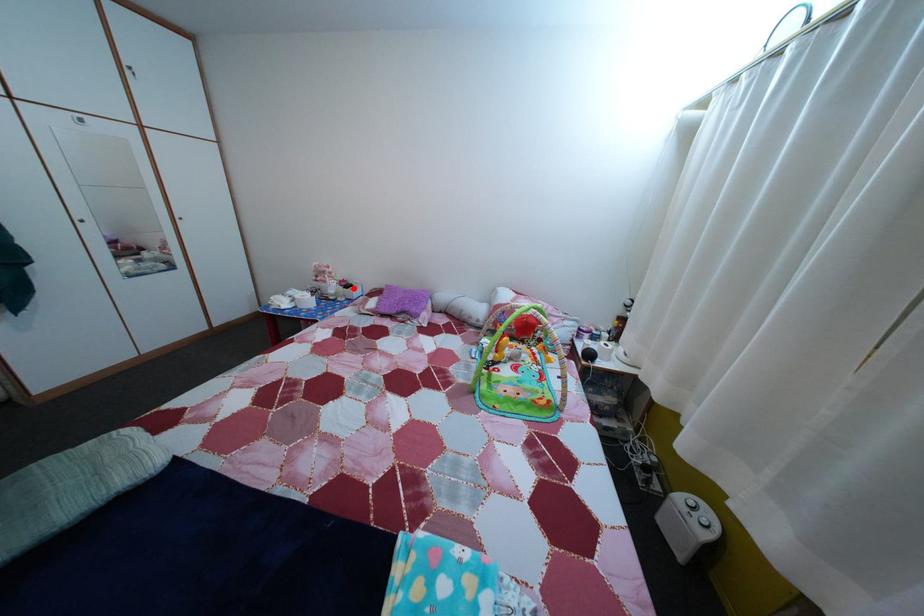
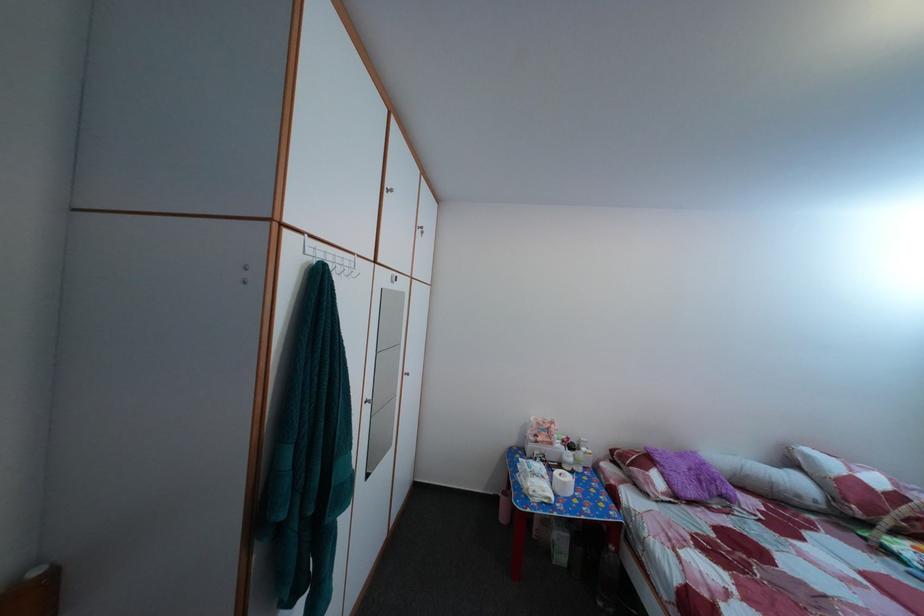
Question: A red point is marked in image1. In image2, is the corresponding 3D point closer to the camera or farther? Reply with the corresponding letter.

Choices:
 (A) The corresponding 3D point is closer.
 (B) The corresponding 3D point is farther.

Answer: (B)